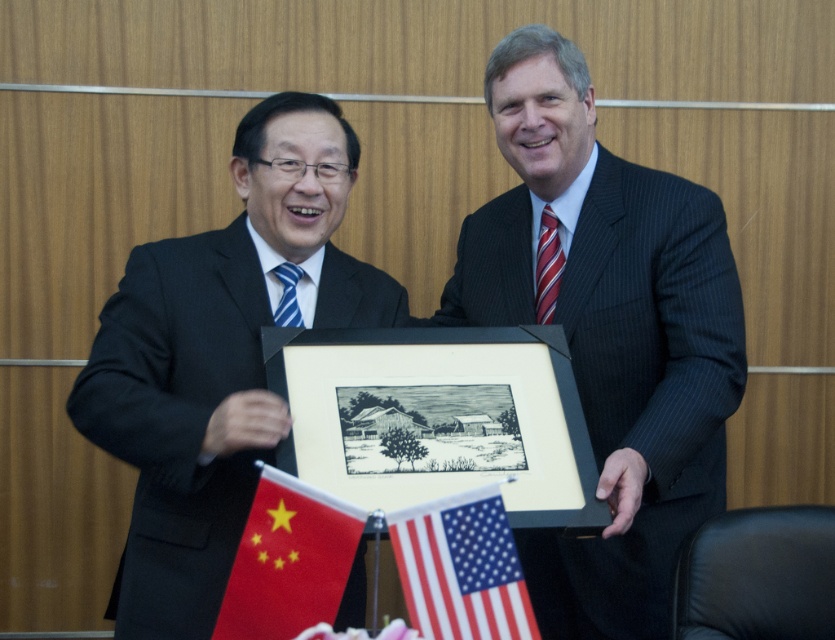
Question: Which of the following is the closest to the observer?

Choices:
 (A) black pinstripe suit at left
 (B) red fabric flag at lower left
 (C) pinstriped dark suit at center

Answer: (B)

Question: Can you confirm if red fabric flag at lower left is bigger than silky fabric flag at lower center?

Choices:
 (A) yes
 (B) no

Answer: (A)

Question: Does black pinstripe suit at left come in front of silky fabric flag at lower center?

Choices:
 (A) no
 (B) yes

Answer: (A)

Question: Which of the following is the farthest from the observer?

Choices:
 (A) red fabric flag at lower left
 (B) black pinstripe suit at left

Answer: (B)

Question: Can you confirm if black pinstripe suit at left is positioned above black matte picture frame at center?

Choices:
 (A) yes
 (B) no

Answer: (A)

Question: Which object is the farthest from the silky fabric flag at lower center?

Choices:
 (A) pinstriped dark suit at center
 (B) black pinstripe suit at left
 (C) red fabric flag at lower left

Answer: (B)